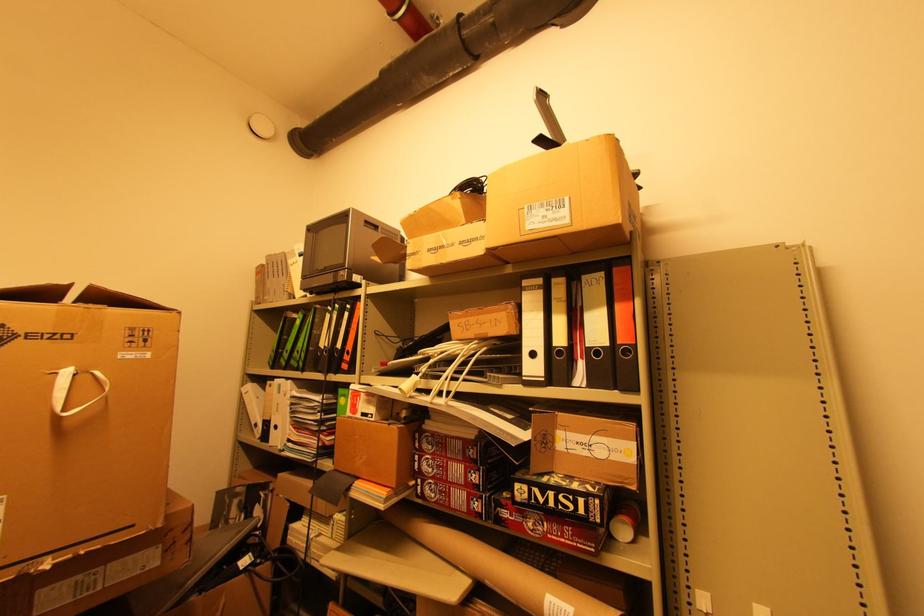
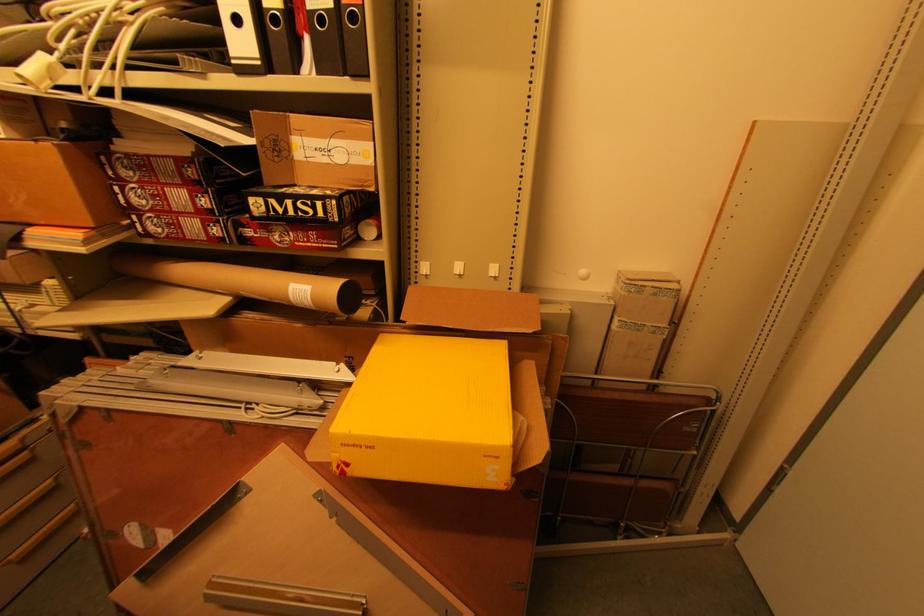
First-person continuous shooting, in which direction is the camera rotating?

The camera rotated toward right-down.